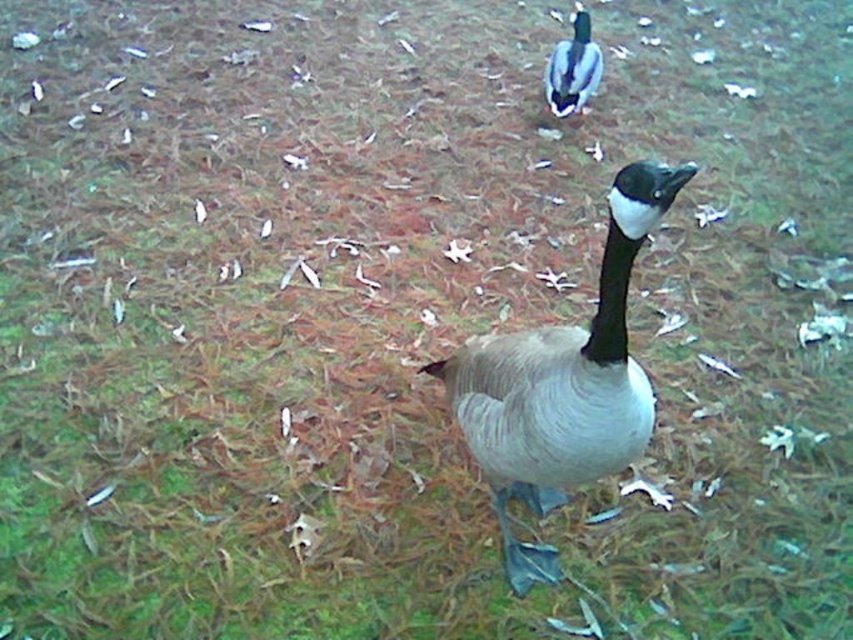
You are a wildlife photographer trying to capture both the gray matte goose at center and the green glossy duck at upper center in a single frame. Given their sizes, which one will appear larger in your photo?

The gray matte goose at center will appear larger in the photo since its width surpasses that of the green glossy duck at upper center.

You are a wildlife photographer trying to capture a photo of the gray matte goose at center and the green glossy duck at upper center. Since you want to ensure both are in focus, you need to know which one is closer to you. Can you determine which bird is nearer based on their sizes?

The gray matte goose at center is bigger than the green glossy duck at upper center, so the gray matte goose at center is closer to you because larger objects in the same scene typically appear closer when they are of the same species or similar type.

You are a photographer aiming to capture the gray matte goose at center in the scene. Given that your camera is focused on the point marked by point (561, 385), will the goose be in focus?

Yes, the point (561, 385) marks the gray matte goose at center, so the goose will be in focus.